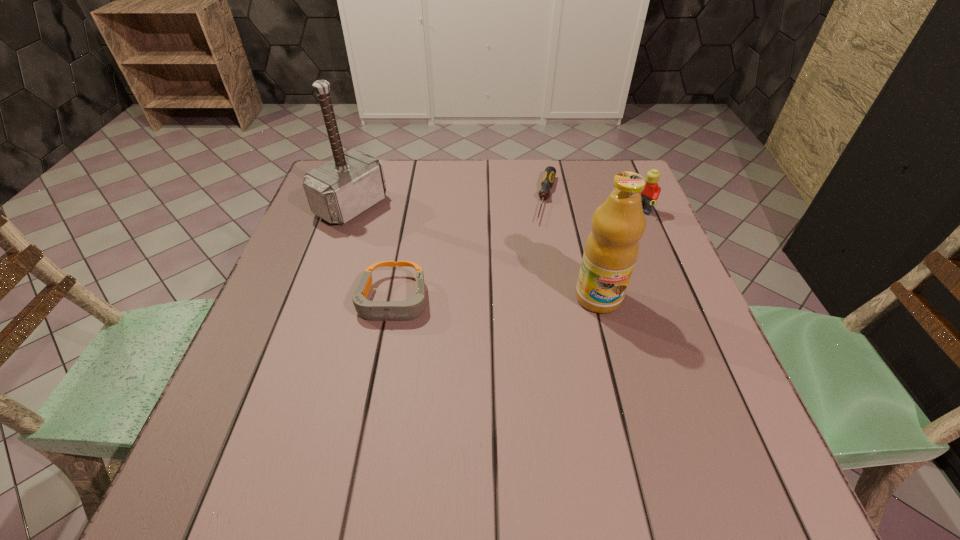
Find the location of `vacant space situated insert the shortest object into a screw head`. vacant space situated insert the shortest object into a screw head is located at coordinates (527, 309).

Image resolution: width=960 pixels, height=540 pixels. Identify the location of vacant area located for striking with the head of the hammer. (396, 232).

Where is `vacant space located for striking with the head of the hammer`? vacant space located for striking with the head of the hammer is located at coordinates (420, 245).

Locate an element on the screen. The width and height of the screenshot is (960, 540). free space located for striking with the head of the hammer is located at coordinates (392, 229).

The height and width of the screenshot is (540, 960). I want to click on free point located 0.400m on the face of the Lego, so click(531, 293).

The height and width of the screenshot is (540, 960). I want to click on free space located on the face of the Lego, so click(538, 289).

Where is `vacant space situated 0.090m on the face of the Lego`? This screenshot has width=960, height=540. vacant space situated 0.090m on the face of the Lego is located at coordinates (613, 232).

Where is `screwdriver at the far edge`? screwdriver at the far edge is located at coordinates (547, 182).

At what (x,y) coordinates should I click in order to perform the action: click on hammer present at the far edge. Please return your answer as a coordinate pair (x, y). Looking at the image, I should click on (341, 189).

This screenshot has height=540, width=960. I want to click on Lego at the far edge, so click(x=651, y=192).